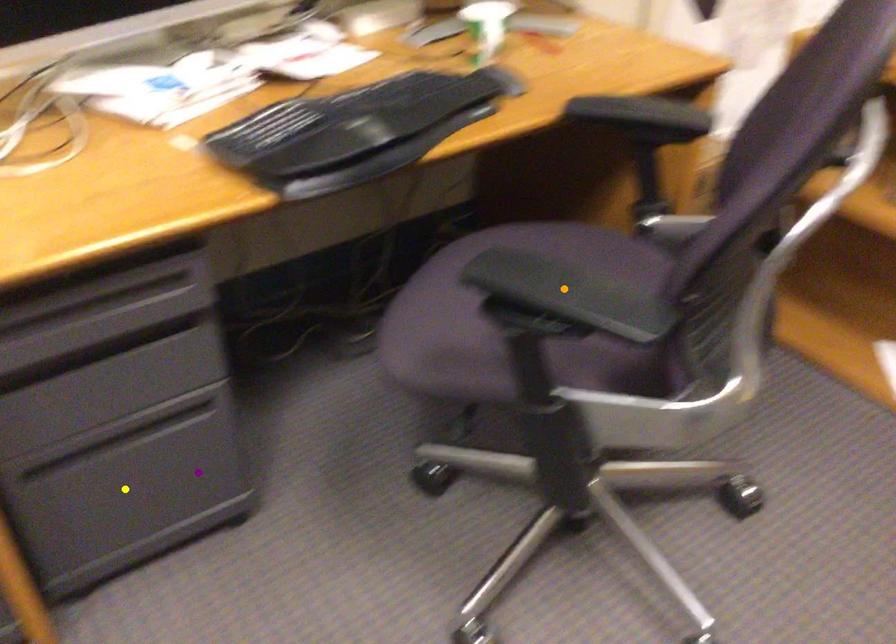
Order these from farthest to nearest:
A) yellow point
B) purple point
C) orange point

1. yellow point
2. purple point
3. orange point